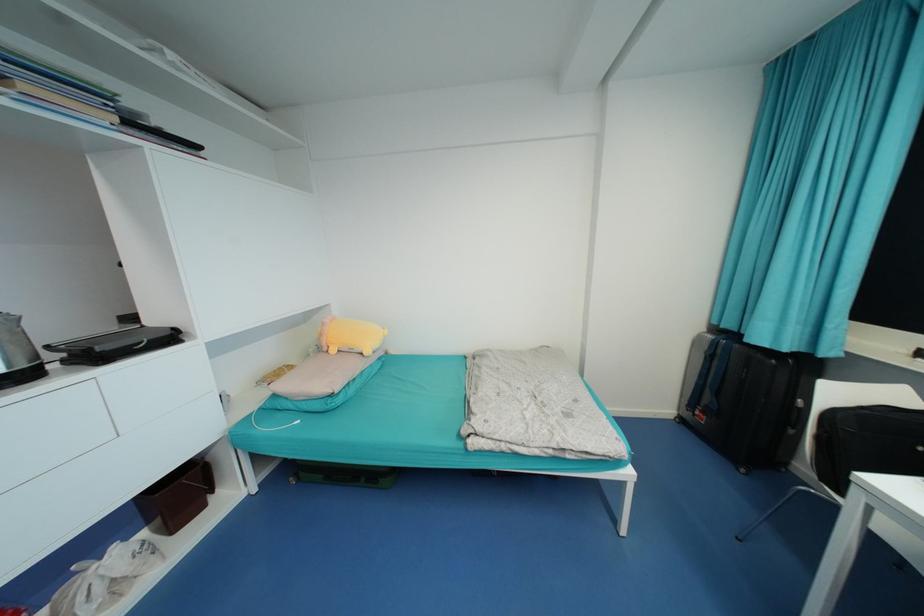
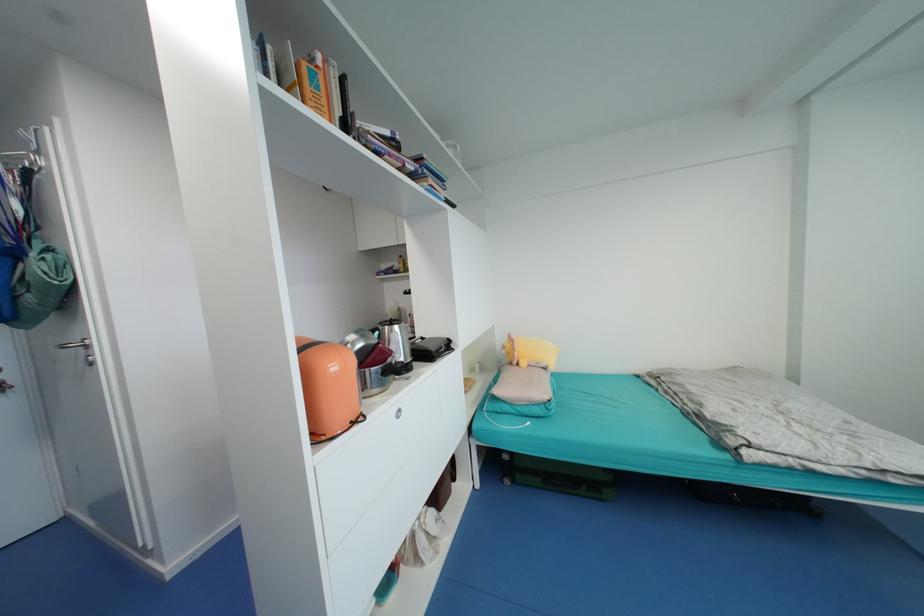
Question: The camera is either moving clockwise (left) or counter-clockwise (right) around the object. The first image is from the beginning of the video and the second image is from the end. Is the camera moving left or right when shooting the video?

Choices:
 (A) Left
 (B) Right

Answer: (B)